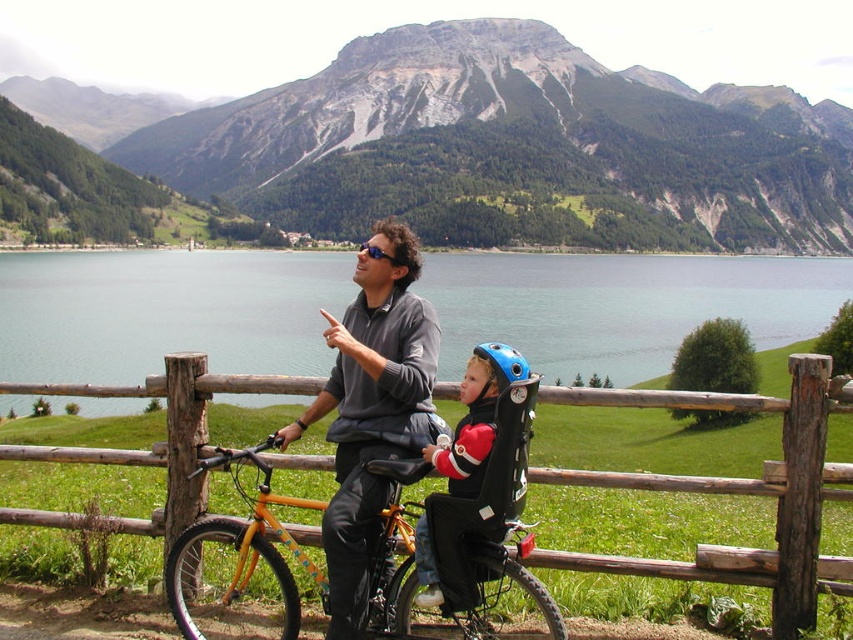
You are a hiker planning to take a photo of the gray rocky mountain at center from the lakeside. Given the coordinates provided, can you estimate whether the mountain will be fully visible in your camera frame if you position yourself at the water edge directly facing it?

The gray rocky mountain at center is located at coordinates point (531, 129). Since the coordinates are within the standard image frame range of 0 to 1, the mountain will be fully visible in your camera frame when positioned at the water edge facing it.

You are a delivery robot that needs to place a small package between the wooden at center and the blue matte helmet at center. The package requires a minimum of 40 feet of space between them. Can you safely place the package there?

The distance between the wooden at center and the blue matte helmet at center is 41.18 feet, which exceeds the required 40 feet. Therefore, you can safely place the package between them.